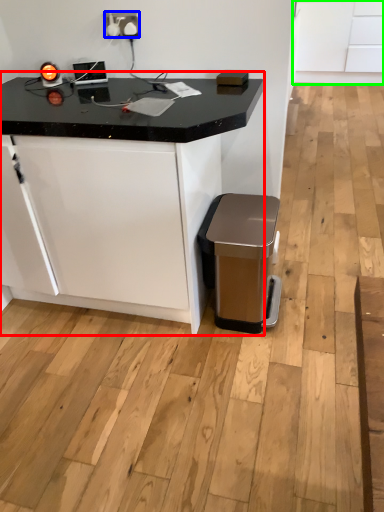
Question: Based on their relative distances, which object is nearer to table (highlighted by a red box)? Choose from electric outlet (highlighted by a blue box) and cabinetry (highlighted by a green box).

Choices:
 (A) electric outlet
 (B) cabinetry

Answer: (A)